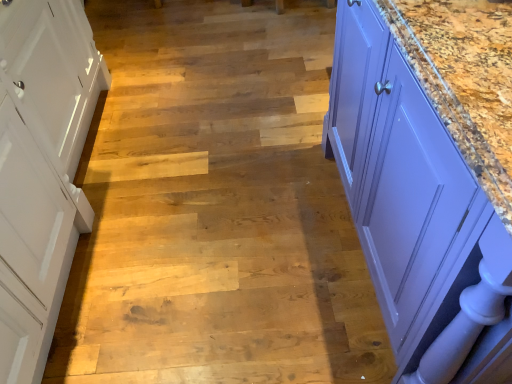
Question: Does purple glossy cabinet at right have a greater width compared to wooden stair at center?

Choices:
 (A) no
 (B) yes

Answer: (A)

Question: Is purple glossy cabinet at right at the left side of wooden stair at center?

Choices:
 (A) no
 (B) yes

Answer: (A)

Question: Is purple glossy cabinet at right surrounding wooden stair at center?

Choices:
 (A) no
 (B) yes

Answer: (A)

Question: Is purple glossy cabinet at right further to camera compared to wooden stair at center?

Choices:
 (A) no
 (B) yes

Answer: (A)

Question: Could you tell me if purple glossy cabinet at right is facing wooden stair at center?

Choices:
 (A) no
 (B) yes

Answer: (A)

Question: Is purple glossy cabinet at right in front of or behind white wood cabinet at left in the image?

Choices:
 (A) front
 (B) behind

Answer: (A)

Question: From a real-world perspective, is purple glossy cabinet at right physically located above or below white wood cabinet at left?

Choices:
 (A) above
 (B) below

Answer: (A)

Question: In terms of width, does purple glossy cabinet at right look wider or thinner when compared to white wood cabinet at left?

Choices:
 (A) thin
 (B) wide

Answer: (B)

Question: Considering the positions of purple glossy cabinet at right and white wood cabinet at left in the image, is purple glossy cabinet at right taller or shorter than white wood cabinet at left?

Choices:
 (A) tall
 (B) short

Answer: (A)

Question: From their relative heights in the image, would you say wooden stair at center is taller or shorter than white wood cabinet at left?

Choices:
 (A) short
 (B) tall

Answer: (A)

Question: Choose the correct answer: Is wooden stair at center inside white wood cabinet at left or outside it?

Choices:
 (A) inside
 (B) outside

Answer: (B)

Question: Is point (188, 96) closer or farther from the camera than point (51, 97)?

Choices:
 (A) farther
 (B) closer

Answer: (A)

Question: Is wooden stair at center in front of or behind white wood cabinet at left in the image?

Choices:
 (A) behind
 (B) front

Answer: (A)

Question: From the image's perspective, is white wood cabinet at left above or below wooden stair at center?

Choices:
 (A) above
 (B) below

Answer: (B)

Question: Choose the correct answer: Is white wood cabinet at left inside wooden stair at center or outside it?

Choices:
 (A) outside
 (B) inside

Answer: (A)